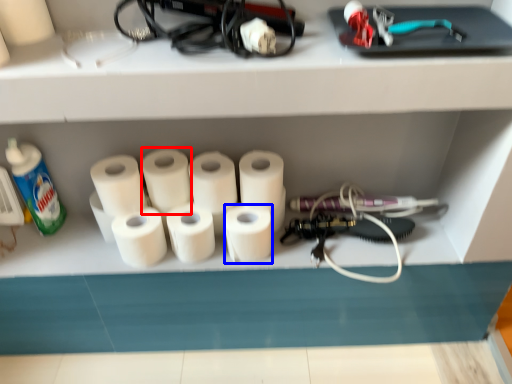
Question: Which object appears closest to the camera in this image, toilet paper (highlighted by a red box) or toilet paper (highlighted by a blue box)?

Choices:
 (A) toilet paper
 (B) toilet paper

Answer: (B)